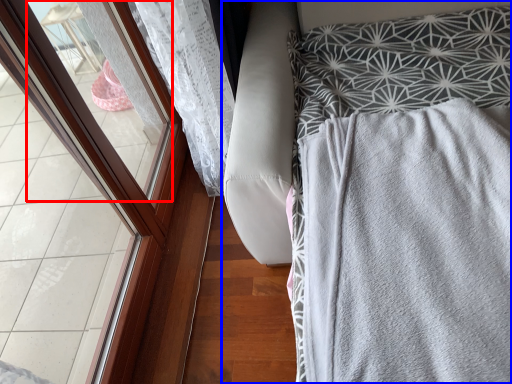
Question: Which point is further to the camera, window (highlighted by a red box) or furniture (highlighted by a blue box)?

Choices:
 (A) window
 (B) furniture

Answer: (A)